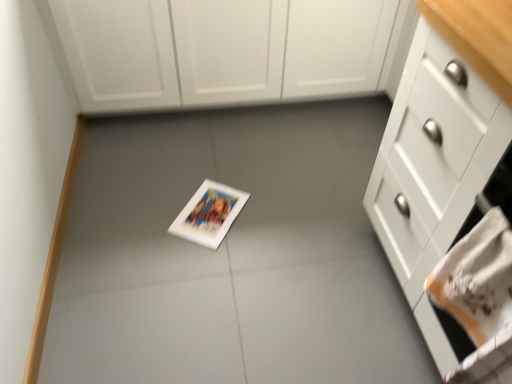
Locate an element on the screen. The image size is (512, 384). white glossy cabinet at right, positioned as the first cabinetry in front-to-back order is located at coordinates (444, 152).

Locate an element on the screen. white embroidered hand towel at lower right is located at coordinates (479, 297).

Does point (496, 279) lie behind point (508, 53)?

No.

What's the angular difference between white embroidered hand towel at lower right and white glossy cabinet at right, positioned as the first cabinetry in front-to-back order,'s facing directions?

The angular difference between white embroidered hand towel at lower right and white glossy cabinet at right, positioned as the first cabinetry in front-to-back order, is 0.164 degrees.

Would you say white embroidered hand towel at lower right is a long distance from white glossy cabinet at right, positioned as the first cabinetry in front-to-back order?

No, white embroidered hand towel at lower right is not far from white glossy cabinet at right, positioned as the first cabinetry in front-to-back order.

Based on their positions, is white embroidered hand towel at lower right located to the left or right of white glossy cabinet at right, positioned as the first cabinetry in front-to-back order?

white embroidered hand towel at lower right is to the left of white glossy cabinet at right, positioned as the first cabinetry in front-to-back order.

Considering the relative sizes of white matte cabinet at upper center, the first cabinetry from the back, and white glossy cabinet at right, positioned as the first cabinetry in front-to-back order, in the image provided, is white matte cabinet at upper center, the first cabinetry from the back, thinner than white glossy cabinet at right, positioned as the first cabinetry in front-to-back order,?

No.

Which of these two, white matte cabinet at upper center, placed as the second cabinetry when sorted from front to back, or white glossy cabinet at right, positioned as the first cabinetry in front-to-back order, stands shorter?

Standing shorter between the two is white matte cabinet at upper center, placed as the second cabinetry when sorted from front to back.

In the scene shown: Is white matte cabinet at upper center, the first cabinetry from the back, at the right side of white glossy cabinet at right, positioned as the first cabinetry in front-to-back order?

No.

Is white matte cabinet at upper center, acting as the first cabinetry starting from the top, oriented towards white embroidered hand towel at lower right?

Yes, white matte cabinet at upper center, acting as the first cabinetry starting from the top, is facing white embroidered hand towel at lower right.

Which is nearer, (381, 30) or (497, 368)?

Point (497, 368)

From the image's perspective, is white matte cabinet at upper center, acting as the first cabinetry starting from the top, above or below white embroidered hand towel at lower right?

white matte cabinet at upper center, acting as the first cabinetry starting from the top, is situated higher than white embroidered hand towel at lower right in the image.

Between white matte cabinet at upper center, the first cabinetry from the back, and white embroidered hand towel at lower right, which one appears on the right side from the viewer's perspective?

white embroidered hand towel at lower right is more to the right.

Can you tell me how much white glossy cabinet at right, positioned as the first cabinetry in front-to-back order, and white embroidered hand towel at lower right differ in facing direction?

There is a 0.164-degree angle between the facing directions of white glossy cabinet at right, positioned as the first cabinetry in front-to-back order, and white embroidered hand towel at lower right.

Does point (446, 34) come behind point (473, 258)?

Yes.

From the image's perspective, is white glossy cabinet at right, positioned as the first cabinetry in front-to-back order, positioned above or below white embroidered hand towel at lower right?

white glossy cabinet at right, positioned as the first cabinetry in front-to-back order, is situated higher than white embroidered hand towel at lower right in the image.

Consider the image. Considering the sizes of objects white glossy cabinet at right, the second cabinetry in the top-to-bottom sequence, and white embroidered hand towel at lower right in the image provided, who is wider, white glossy cabinet at right, the second cabinetry in the top-to-bottom sequence, or white embroidered hand towel at lower right?

white glossy cabinet at right, the second cabinetry in the top-to-bottom sequence.

Can you confirm if white glossy cabinet at right, which appears as the 1th cabinetry when ordered from the bottom, is bigger than white matte cabinet at upper center, the first cabinetry from the back?

Actually, white glossy cabinet at right, which appears as the 1th cabinetry when ordered from the bottom, might be smaller than white matte cabinet at upper center, the first cabinetry from the back.

Considering the positions of objects white glossy cabinet at right, positioned as the first cabinetry in front-to-back order, and white matte cabinet at upper center, marked as the second cabinetry in a bottom-to-top arrangement, in the image provided, who is in front, white glossy cabinet at right, positioned as the first cabinetry in front-to-back order, or white matte cabinet at upper center, marked as the second cabinetry in a bottom-to-top arrangement,?

Positioned in front is white glossy cabinet at right, positioned as the first cabinetry in front-to-back order.

From the image's perspective, which one is positioned higher, white glossy cabinet at right, which appears as the 1th cabinetry when ordered from the bottom, or white matte cabinet at upper center, acting as the first cabinetry starting from the top?

white matte cabinet at upper center, acting as the first cabinetry starting from the top.

Consider the image. Is white glossy cabinet at right, positioned as the first cabinetry in front-to-back order, turned away from white matte cabinet at upper center, the first cabinetry from the back?

That's not correct — white glossy cabinet at right, positioned as the first cabinetry in front-to-back order, is not looking away from white matte cabinet at upper center, the first cabinetry from the back.

Which is farther from the camera, (470, 321) or (189, 53)?

Positioned behind is point (189, 53).

Which of these two, white embroidered hand towel at lower right or white matte cabinet at upper center, the first cabinetry from the back, is wider?

With larger width is white matte cabinet at upper center, the first cabinetry from the back.

Where is `hand towel above the white matte cabinet at upper center, marked as the second cabinetry in a bottom-to-top arrangement (from a real-world perspective)`? The width and height of the screenshot is (512, 384). hand towel above the white matte cabinet at upper center, marked as the second cabinetry in a bottom-to-top arrangement (from a real-world perspective) is located at coordinates (479, 297).

From the picture: Is white embroidered hand towel at lower right touching white matte cabinet at upper center, the first cabinetry from the back?

white embroidered hand towel at lower right is not next to white matte cabinet at upper center, the first cabinetry from the back, and they're not touching.

Where is `hand towel behind the white glossy cabinet at right, positioned as the first cabinetry in front-to-back order`? The image size is (512, 384). hand towel behind the white glossy cabinet at right, positioned as the first cabinetry in front-to-back order is located at coordinates (479, 297).

This screenshot has height=384, width=512. What are the coordinates of `cabinetry positioned vertically above the white matte cabinet at upper center, placed as the second cabinetry when sorted from front to back (from a real-world perspective)` in the screenshot? It's located at (444, 152).

From the image, which object appears to be farther from white matte cabinet at upper center, acting as the first cabinetry starting from the top, white embroidered hand towel at lower right or white glossy cabinet at right, the 2th cabinetry in the back-to-front sequence?

white embroidered hand towel at lower right lies further to white matte cabinet at upper center, acting as the first cabinetry starting from the top, than the other object.

Estimate the real-world distances between objects in this image. Which object is closer to white glossy cabinet at right, the second cabinetry in the top-to-bottom sequence, white embroidered hand towel at lower right or white matte cabinet at upper center, marked as the second cabinetry in a bottom-to-top arrangement?

The object closer to white glossy cabinet at right, the second cabinetry in the top-to-bottom sequence, is white embroidered hand towel at lower right.

Estimate the real-world distances between objects in this image. Which object is further from white embroidered hand towel at lower right, white matte cabinet at upper center, placed as the second cabinetry when sorted from front to back, or white glossy cabinet at right, positioned as the first cabinetry in front-to-back order?

white matte cabinet at upper center, placed as the second cabinetry when sorted from front to back, is positioned further to the anchor white embroidered hand towel at lower right.

Based on their spatial positions, is white glossy cabinet at right, positioned as the first cabinetry in front-to-back order, or white matte cabinet at upper center, marked as the second cabinetry in a bottom-to-top arrangement, further from white embroidered hand towel at lower right?

Among the two, white matte cabinet at upper center, marked as the second cabinetry in a bottom-to-top arrangement, is located further to white embroidered hand towel at lower right.

Looking at the image, which one is located closer to white glossy cabinet at right, positioned as the first cabinetry in front-to-back order, white matte cabinet at upper center, placed as the second cabinetry when sorted from front to back, or white embroidered hand towel at lower right?

Among the two, white embroidered hand towel at lower right is located nearer to white glossy cabinet at right, positioned as the first cabinetry in front-to-back order.

Looking at the image, which one is located further to white matte cabinet at upper center, placed as the second cabinetry when sorted from front to back, white glossy cabinet at right, the 2th cabinetry in the back-to-front sequence, or white embroidered hand towel at lower right?

white embroidered hand towel at lower right lies further to white matte cabinet at upper center, placed as the second cabinetry when sorted from front to back, than the other object.

Identify the location of cabinetry between white matte cabinet at upper center, the first cabinetry from the back, and white embroidered hand towel at lower right, in the vertical direction. The image size is (512, 384). (444, 152).